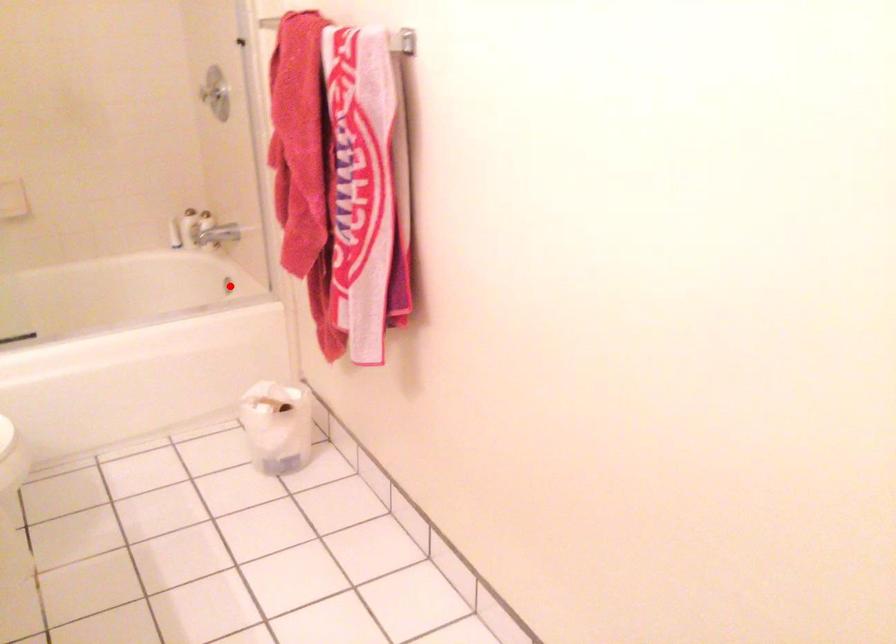
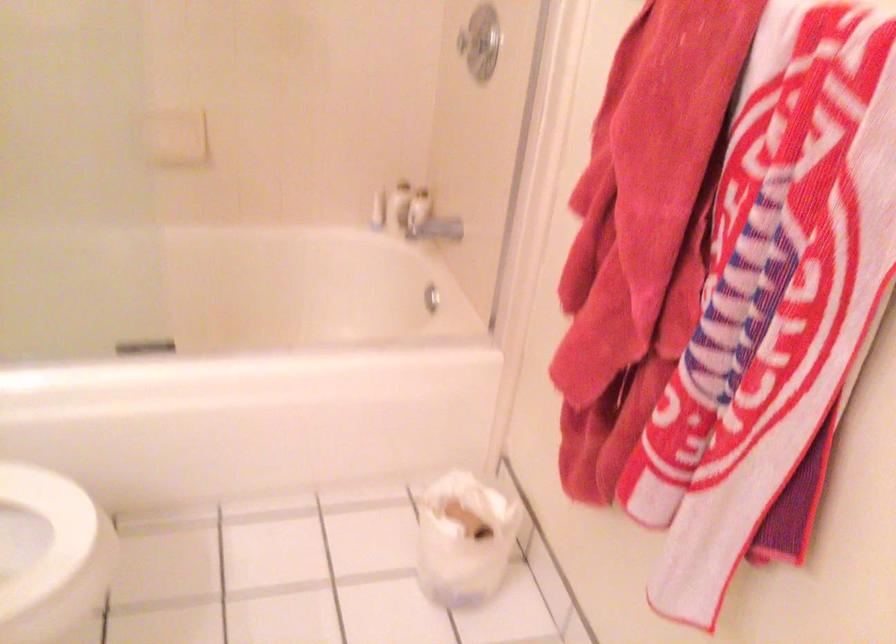
In the second image, find the point that corresponds to the highlighted location in the first image.

(431, 298)